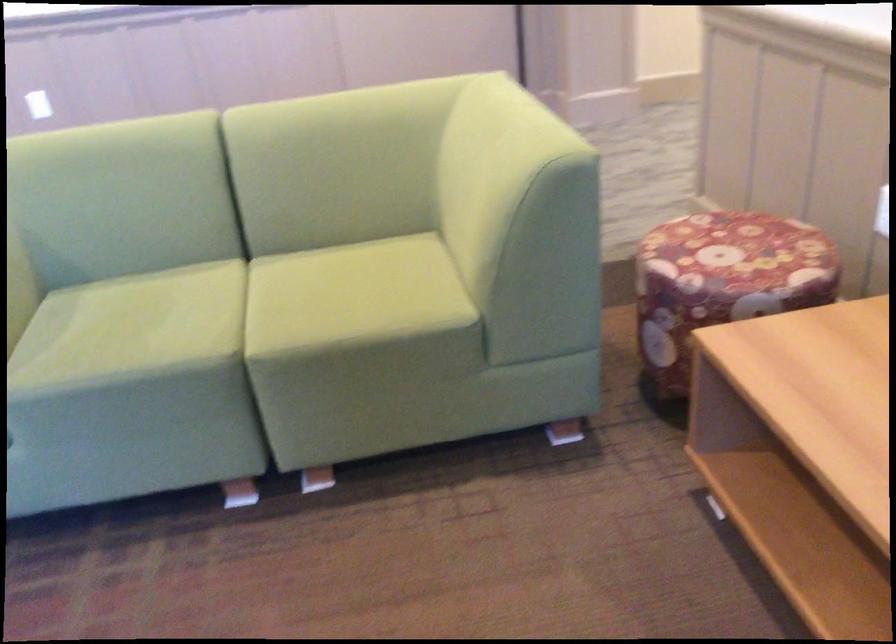
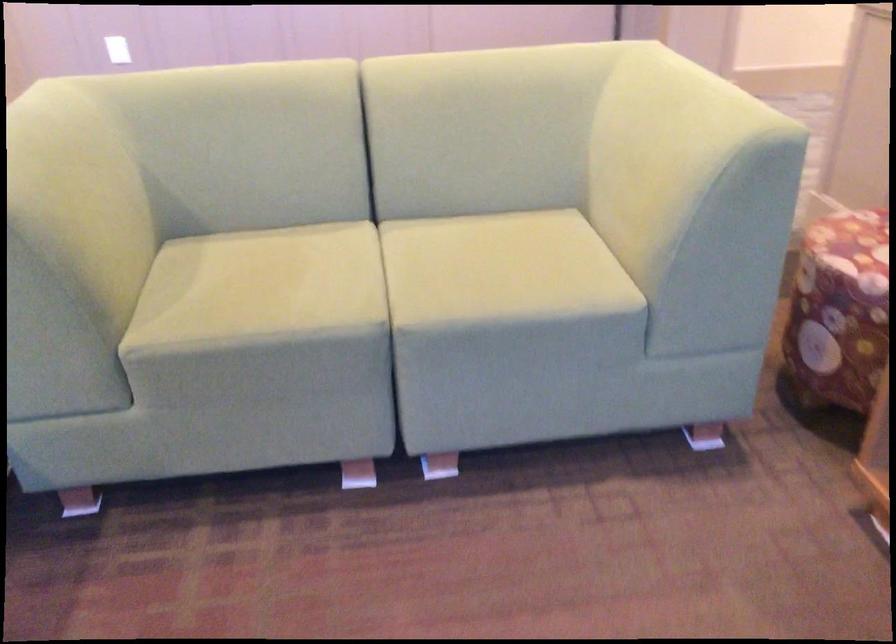
Question: How did the camera likely rotate?

Choices:
 (A) Left
 (B) Right
 (C) Up
 (D) Down

Answer: (D)